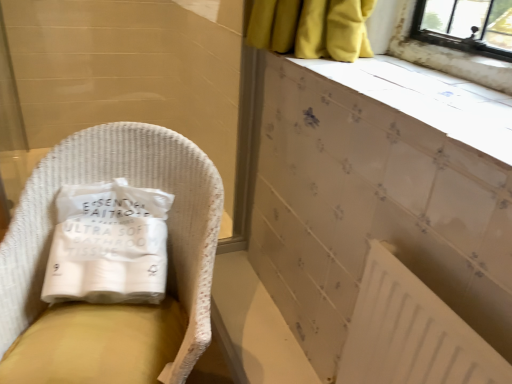
Describe the element at coordinates (429, 99) in the screenshot. The image size is (512, 384). I see `white textured ledge at upper right` at that location.

What is the approximate width of white wicker chair at left?

white wicker chair at left is 25.12 inches in width.

The image size is (512, 384). What are the coordinates of `white textured ledge at upper right` in the screenshot? It's located at (429, 99).

How distant is white wicker chair at left from white paper towel at left?

white wicker chair at left and white paper towel at left are 4.05 inches apart.

Could you tell me if white wicker chair at left is facing white paper towel at left?

Yes, white wicker chair at left is facing white paper towel at left.

Is white wicker chair at left smaller than white paper towel at left?

Incorrect, white wicker chair at left is not smaller in size than white paper towel at left.

From a real-world perspective, is white wicker chair at left positioned above or below white paper towel at left?

Clearly, from a real-world perspective, white wicker chair at left is below white paper towel at left.

Which is more to the left, white matte radiator at lower right or white textured ledge at upper right?

white matte radiator at lower right.

In the scene shown: Which is closer to the camera, (455, 342) or (500, 128)?

The point (455, 342) is closer to the camera.

From the picture: Is white matte radiator at lower right wider or thinner than white textured ledge at upper right?

Considering their sizes, white matte radiator at lower right looks slimmer than white textured ledge at upper right.

How many degrees apart are the facing directions of white matte radiator at lower right and white textured ledge at upper right?

There is a 0.559-degree angle between the facing directions of white matte radiator at lower right and white textured ledge at upper right.

From the picture: From a real-world perspective, relative to white textured ledge at upper right, is white wicker chair at left vertically above or below?

white wicker chair at left is situated lower than white textured ledge at upper right in the real world.

Is white wicker chair at left directly adjacent to white textured ledge at upper right?

There is a gap between white wicker chair at left and white textured ledge at upper right.

Which is in front, point (150, 131) or point (497, 104)?

The point (497, 104) is closer.

Which object is wider, white wicker chair at left or white textured ledge at upper right?

white wicker chair at left is wider.

The height and width of the screenshot is (384, 512). I want to click on ledge above the white paper towel at left (from a real-world perspective), so click(429, 99).

From the image's perspective, does white paper towel at left appear lower than white textured ledge at upper right?

Indeed, from the image's perspective, white paper towel at left is shown beneath white textured ledge at upper right.

From the picture: Do you think white paper towel at left is within white textured ledge at upper right, or outside of it?

white paper towel at left is spatially situated outside white textured ledge at upper right.

Measure the distance between white paper towel at left and white textured ledge at upper right.

29.62 inches.

How far apart are white textured ledge at upper right and white paper towel at left?

white textured ledge at upper right is 75.24 centimeters from white paper towel at left.

Which is more to the right, white textured ledge at upper right or white paper towel at left?

white textured ledge at upper right.

From a real-world perspective, is white textured ledge at upper right over white paper towel at left?

Yes, from a real-world perspective, white textured ledge at upper right is on top of white paper towel at left.

Would you say white textured ledge at upper right is a long distance from white paper towel at left?

No, white textured ledge at upper right is not far away from white paper towel at left.

Considering the relative positions of white wicker chair at left and white matte radiator at lower right in the image provided, is white wicker chair at left to the left or to the right of white matte radiator at lower right?

Based on their positions, white wicker chair at left is located to the left of white matte radiator at lower right.

Between white wicker chair at left and white matte radiator at lower right, which one has larger size?

white wicker chair at left.

Is white wicker chair at left completely or partially outside of white matte radiator at lower right?

white wicker chair at left is positioned outside white matte radiator at lower right.

Is white textured ledge at upper right positioned far away from white wicker chair at left?

No.

Is white textured ledge at upper right taller than white wicker chair at left?

No.

Considering their positions, is white textured ledge at upper right located in front of or behind white wicker chair at left?

Clearly, white textured ledge at upper right is in front of white wicker chair at left.

Where is `material behind the white wicker chair at left`? The height and width of the screenshot is (384, 512). material behind the white wicker chair at left is located at coordinates (108, 244).

Locate an element on the screen. This screenshot has width=512, height=384. ledge that is on the right side of white matte radiator at lower right is located at coordinates (429, 99).

Estimate the real-world distances between objects in this image. Which object is closer to white matte radiator at lower right, white paper towel at left or white wicker chair at left?

white wicker chair at left is closer to white matte radiator at lower right.

Which object lies nearer to the anchor point white paper towel at left, white textured ledge at upper right or white wicker chair at left?

Among the two, white wicker chair at left is located nearer to white paper towel at left.

Based on their spatial positions, is white wicker chair at left or white matte radiator at lower right further from white textured ledge at upper right?

white wicker chair at left is further to white textured ledge at upper right.

Estimate the real-world distances between objects in this image. Which object is further from white wicker chair at left, white paper towel at left or white matte radiator at lower right?

white matte radiator at lower right is positioned further to the anchor white wicker chair at left.

Estimate the real-world distances between objects in this image. Which object is closer to white matte radiator at lower right, white textured ledge at upper right or white paper towel at left?

white textured ledge at upper right is closer to white matte radiator at lower right.

From the image, which object appears to be farther from white wicker chair at left, white matte radiator at lower right or white textured ledge at upper right?

white textured ledge at upper right lies further to white wicker chair at left than the other object.

Considering their positions, is white textured ledge at upper right positioned further to white matte radiator at lower right than white wicker chair at left?

white wicker chair at left is positioned further to the anchor white matte radiator at lower right.

Estimate the real-world distances between objects in this image. Which object is closer to white textured ledge at upper right, white paper towel at left or white wicker chair at left?

white wicker chair at left.

Identify the location of furniture between white paper towel at left and white matte radiator at lower right. Image resolution: width=512 pixels, height=384 pixels. (113, 305).

Where is `radiator located between white wicker chair at left and white textured ledge at upper right in the left-right direction`? Image resolution: width=512 pixels, height=384 pixels. radiator located between white wicker chair at left and white textured ledge at upper right in the left-right direction is located at coordinates (411, 333).

Where is `radiator situated between white paper towel at left and white textured ledge at upper right from left to right`? The height and width of the screenshot is (384, 512). radiator situated between white paper towel at left and white textured ledge at upper right from left to right is located at coordinates (411, 333).

Identify the location of furniture between white paper towel at left and white textured ledge at upper right from left to right. The height and width of the screenshot is (384, 512). (x=113, y=305).